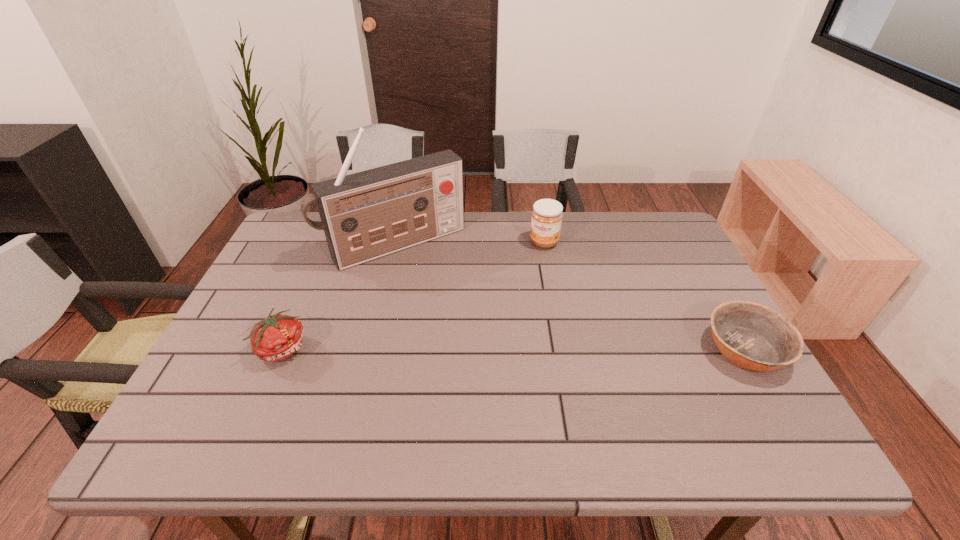
The image size is (960, 540). What are the coordinates of `tomato` in the screenshot? It's located at (276, 338).

Where is `the shortest object`? The height and width of the screenshot is (540, 960). the shortest object is located at coordinates (754, 337).

Find the location of a particular element. Image resolution: width=960 pixels, height=540 pixels. the rightmost object is located at coordinates (754, 337).

Locate an element on the screen. the third object from left to right is located at coordinates (546, 220).

In order to click on jam in this screenshot , I will do point(546,220).

The height and width of the screenshot is (540, 960). Identify the location of the tallest object. (366, 215).

At what (x,y) coordinates should I click in order to perform the action: click on vacant space positioned on the front-facing side of the second shortest object. Please return your answer as a coordinate pair (x, y). This screenshot has height=540, width=960. Looking at the image, I should click on (442, 348).

This screenshot has width=960, height=540. Find the location of `blank area located on the back of the shortest object`. blank area located on the back of the shortest object is located at coordinates (697, 267).

This screenshot has width=960, height=540. Identify the location of vacant area situated on the front label of the second object from right to left. (523, 295).

Find the location of a particular element. The height and width of the screenshot is (540, 960). free location located on the front label of the second object from right to left is located at coordinates (529, 279).